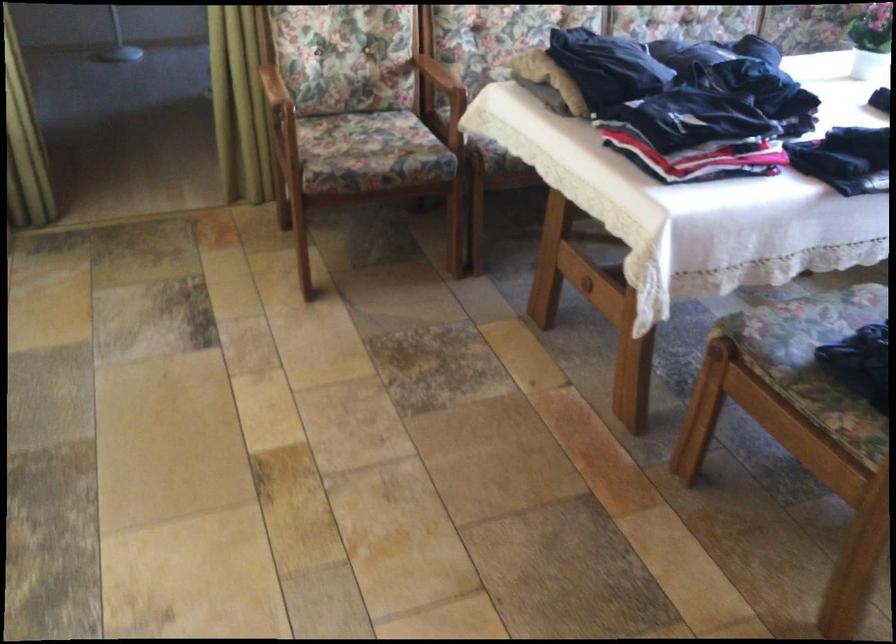
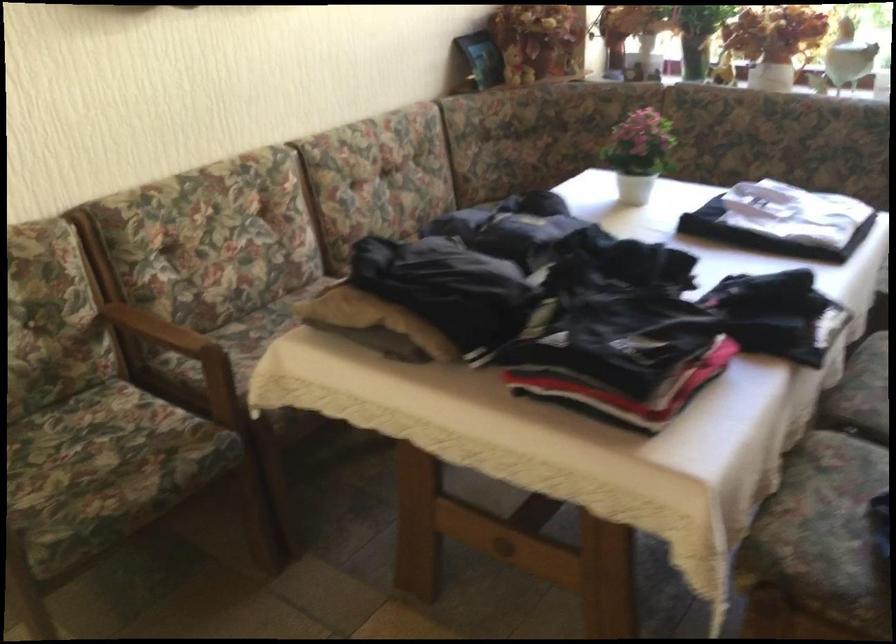
Locate, in the second image, the point that corresponds to (x=666, y=98) in the first image.

(589, 317)